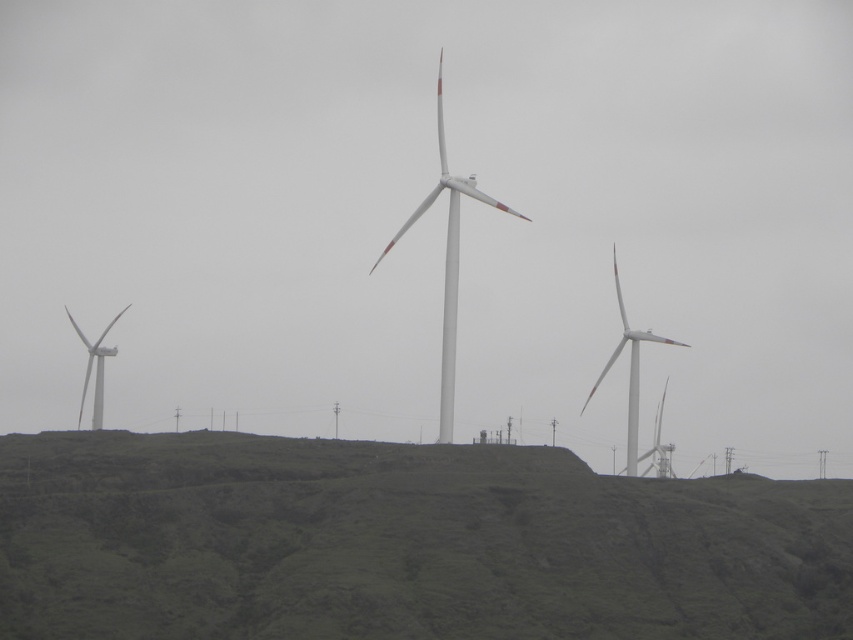
Is green grassy hillside at center positioned behind white matte windmill at center?

No, green grassy hillside at center is in front of white matte windmill at center.

Is point (231, 572) positioned after point (467, 179)?

No, it is not.

I want to click on green grassy hillside at center, so click(402, 544).

Based on the photo, which of these two, green grassy hillside at center or white matte windmill at right, stands shorter?

green grassy hillside at center

Who is more distant from viewer, (303, 472) or (634, 362)?

The point (634, 362) is behind.

Between point (15, 435) and point (612, 260), which one is positioned in front?

Point (15, 435) is more forward.

At what (x,y) coordinates should I click in order to perform the action: click on green grassy hillside at center. Please return your answer as a coordinate pair (x, y). This screenshot has height=640, width=853. Looking at the image, I should click on (402, 544).

Does white matte windmill at center appear over white matte windmill at right?

Yes, white matte windmill at center is above white matte windmill at right.

Does white matte windmill at center have a lesser height compared to white matte windmill at right?

No, white matte windmill at center is not shorter than white matte windmill at right.

Between point (442, 141) and point (613, 243), which one is positioned in front?

Positioned in front is point (442, 141).

Image resolution: width=853 pixels, height=640 pixels. In order to click on white matte windmill at center in this screenshot , I will do `click(447, 259)`.